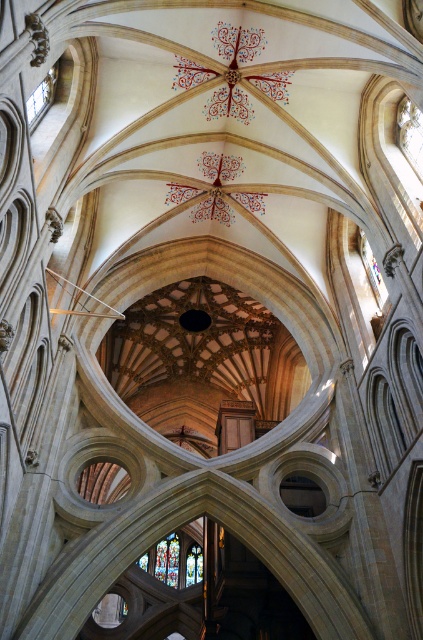
You are standing inside the cathedral and want to take a photo of both the stained glass at lower center and the transparent glass window at upper left. Which one will appear larger in your camera viewfinder?

The stained glass at lower center appears larger in the camera viewfinder because it is closer to the viewer than the transparent glass window at upper left.

You are an architect visiting the cathedral and want to compare the two windows. Which one is located to the right of the other? The transparent stained glass at upper right and the transparent glass window at upper left are both in your view. Could you tell me which one is on the right side of the other?

The transparent stained glass at upper right is positioned on the right side of the transparent glass window at upper left.

You are an architect visiting the cathedral and need to determine which window allows more natural light into the space. Based on their sizes, which of the two windows, the stained glass at lower center or the transparent glass window at upper left, would let in more light?

The stained glass at lower center is larger in size than the transparent glass window at upper left, so it would allow more natural light into the space.